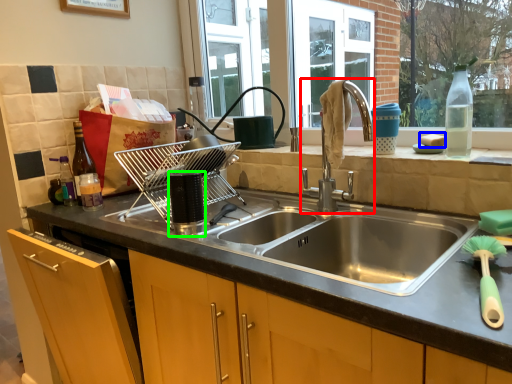
Question: Which is nearer to the tap (highlighted by a red box)? food (highlighted by a blue box) or appliance (highlighted by a green box).

Choices:
 (A) food
 (B) appliance

Answer: (A)